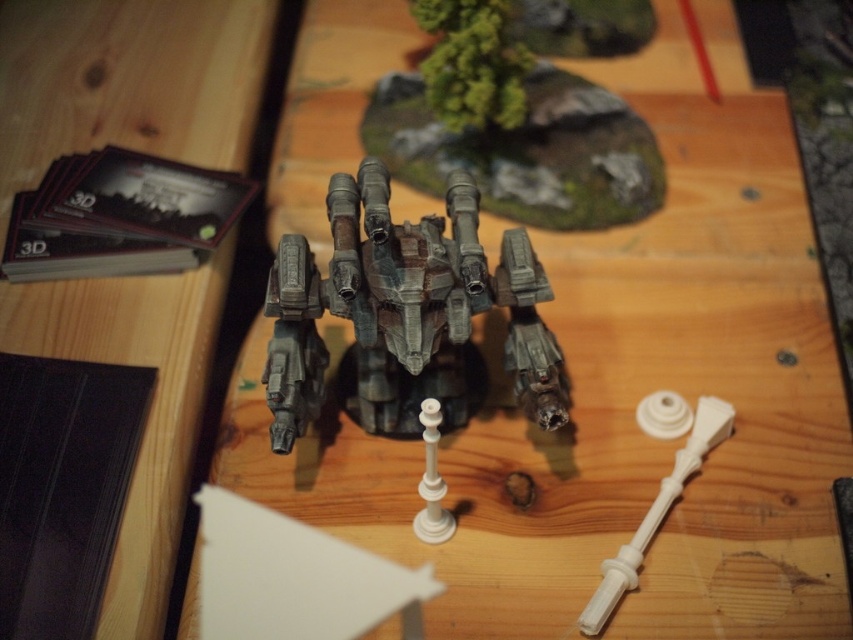
Looking at this image, is rustic metal terrain at upper center closer to the viewer compared to white plastic handle at center?

That is False.

Which is in front, point (517, 157) or point (616, 589)?

Point (616, 589) is in front.

Is point (433, 172) farther from viewer compared to point (624, 568)?

Yes, it is.

The image size is (853, 640). What are the coordinates of `rustic metal terrain at upper center` in the screenshot? It's located at (526, 150).

Between rusty metal mech at center and rustic metal terrain at upper center, which one has more height?

rustic metal terrain at upper center is taller.

Is rusty metal mech at center smaller than rustic metal terrain at upper center?

Yes, rusty metal mech at center is smaller than rustic metal terrain at upper center.

You are a GUI agent. You are given a task and a screenshot of the screen. Output one action in this format:
    pyautogui.click(x=<x>, y=<y>)
    Task: Click on the rusty metal mech at center
    The height and width of the screenshot is (640, 853).
    Given the screenshot: What is the action you would take?
    pyautogui.click(x=404, y=314)

Which is more to the left, rusty metal mech at center or white plastic handle at center?

rusty metal mech at center is more to the left.

Who is more forward, (386, 428) or (703, 442)?

Positioned in front is point (703, 442).

At what (x,y) coordinates should I click in order to perform the action: click on rusty metal mech at center. Please return your answer as a coordinate pair (x, y). The image size is (853, 640). Looking at the image, I should click on (404, 314).